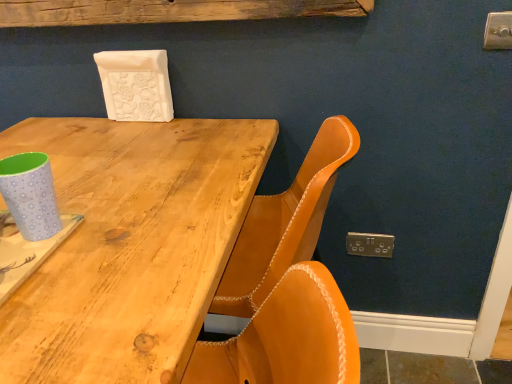
Where is `space that is in front of light blue polka dot paper cup at left`? The height and width of the screenshot is (384, 512). space that is in front of light blue polka dot paper cup at left is located at coordinates (57, 297).